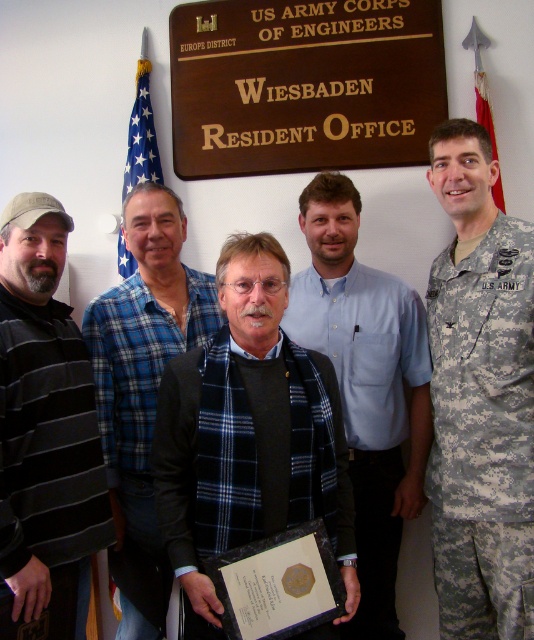
You are a photographer standing in front of the US Army Corps of Engineers Europe District Wiesbaden Resident Office. You need to take a group photo of the black matte uniform at center and the blue plaid shirt at center. The camera you have can only focus on objects within 16 inches. Will both subjects be in focus?

The black matte uniform at center is 16.28 inches from the blue plaid shirt at center. Since the camera can only focus within 16 inches, the distance between them exceeds the focus range. Therefore, both subjects may not be in focus simultaneously.

You are an event planner organizing a photo shoot in the described office space. You need to arrange two key individuals wearing the black matte uniform at center and the blue plaid shirt at center. Given their clothing sizes, which individual should you place closer to the camera to ensure both appear proportionate in the final photo?

The black matte uniform at center is smaller in size compared to the blue plaid shirt at center. To make them appear proportionate in the photo, place the individual in the black matte uniform at center closer to the camera so that their smaller size is visually balanced against the larger blue plaid shirt at center.

Based on the scene description, which object corresponds to the coordinates point (44,433)?

The coordinates point (44,433) correspond to the black striped sweater at left.